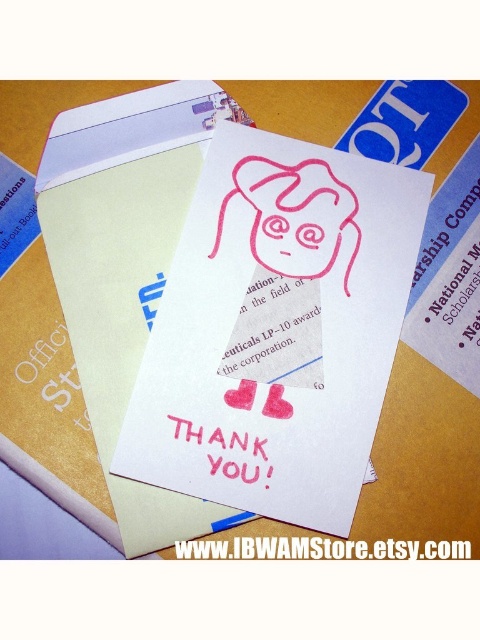
You are organizing a collection of documents and notice the pink rubber stamp at center and the pink matte paper at center. Which item is positioned higher on the page?

The pink rubber stamp at center is above the pink matte paper at center, so it is positioned higher on the page.

You are organizing a display and need to stack the pink matte paper card at center and the pink rubber stamp at center vertically. Which object should be placed at the bottom to ensure stability?

The pink matte paper card at center should be placed at the bottom because it has a greater height than the pink rubber stamp at center, providing a stable base for the stack.